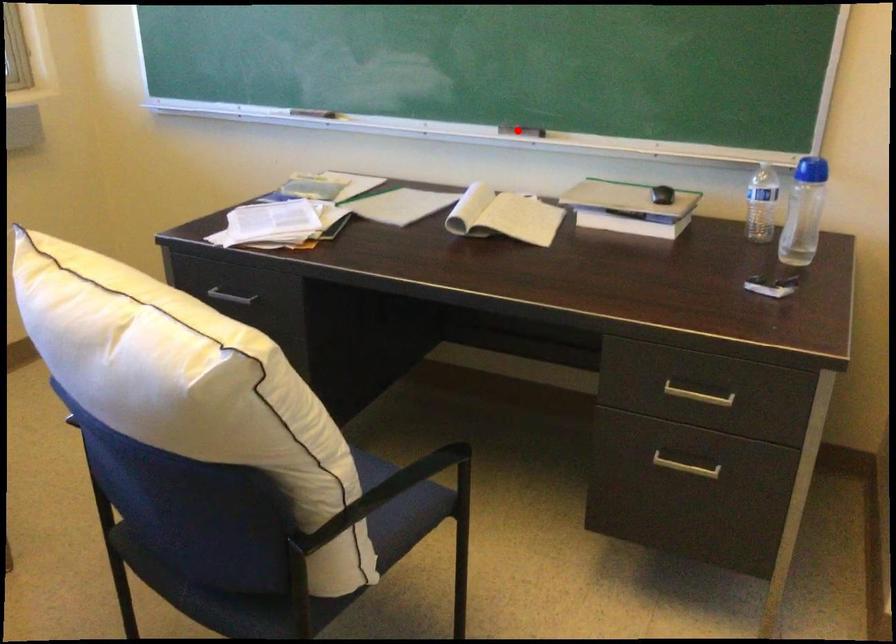
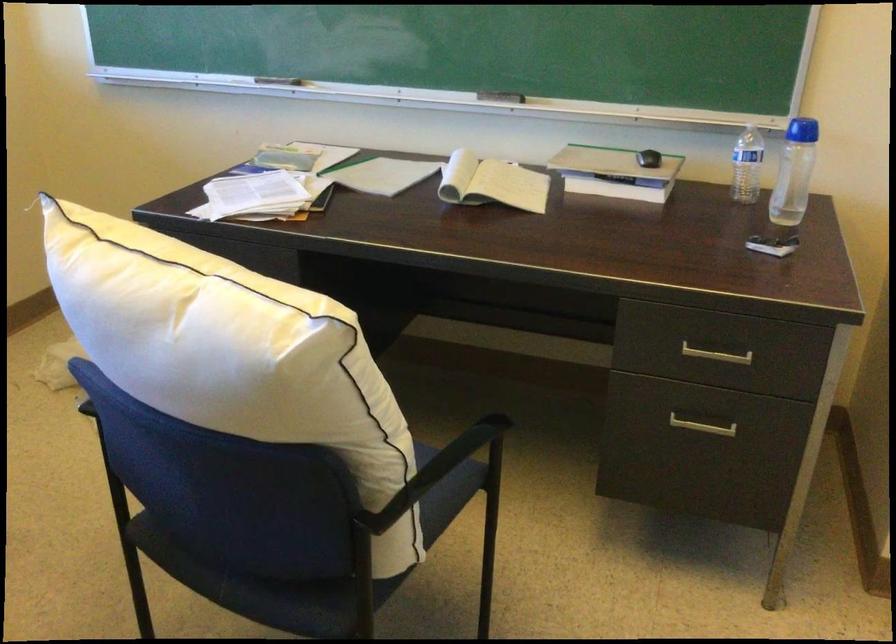
Locate, in the second image, the point that corresponds to the highlighted location in the first image.

(501, 96)